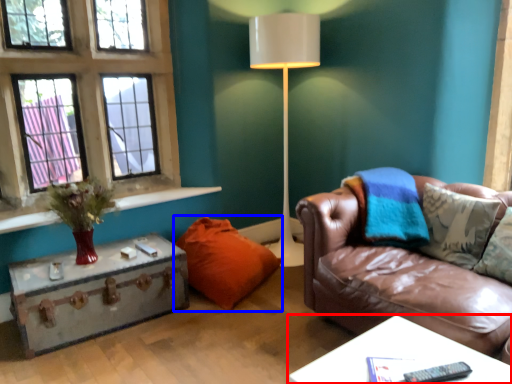
Question: Among these objects, which one is farthest to the camera, table (highlighted by a red box) or pillow (highlighted by a blue box)?

Choices:
 (A) table
 (B) pillow

Answer: (B)